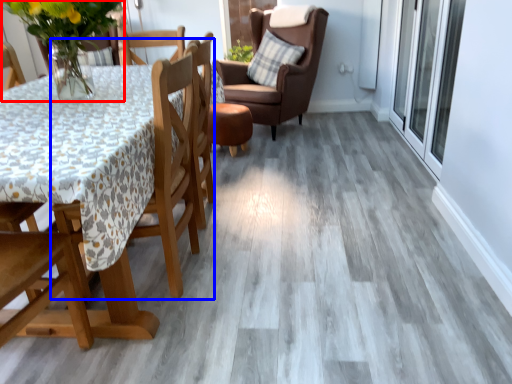
Question: Which point is closer to the camera, floral arrangement (highlighted by a red box) or chair (highlighted by a blue box)?

Choices:
 (A) floral arrangement
 (B) chair

Answer: (B)